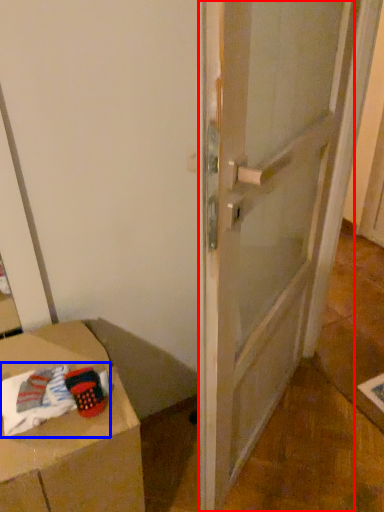
Question: Which point is closer to the camera, door (highlighted by a red box) or laundry (highlighted by a blue box)?

Choices:
 (A) door
 (B) laundry

Answer: (A)